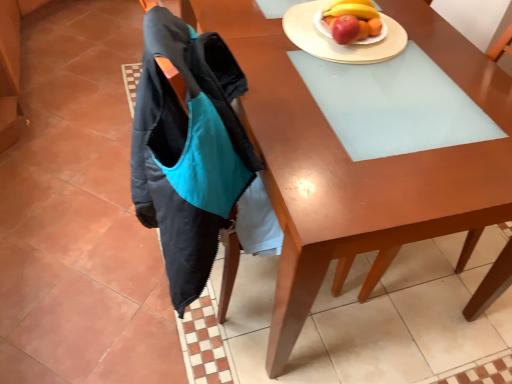
Where is `free spot in front of white glossy plate at upper right, arranged as the second plate when viewed from the left`? Image resolution: width=512 pixels, height=384 pixels. free spot in front of white glossy plate at upper right, arranged as the second plate when viewed from the left is located at coordinates (352, 66).